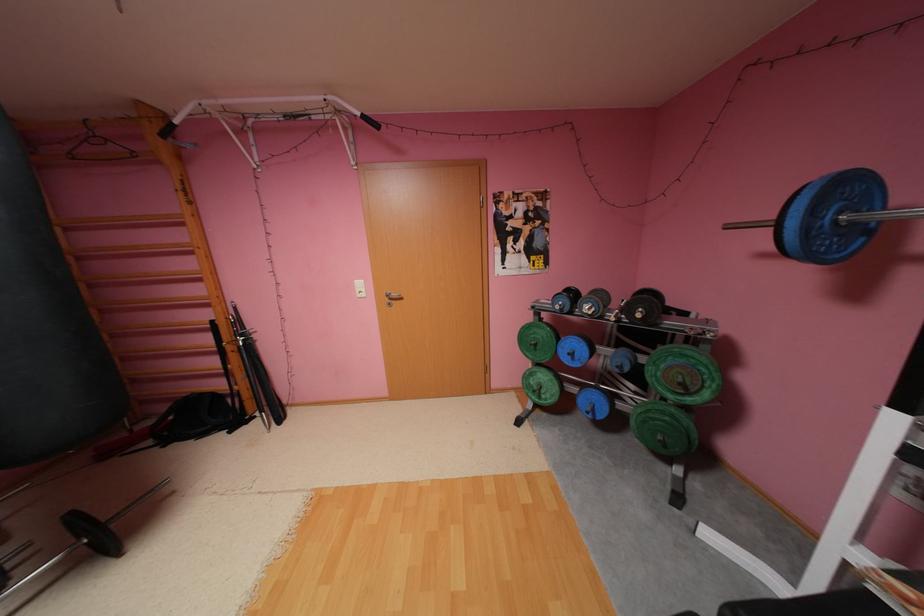
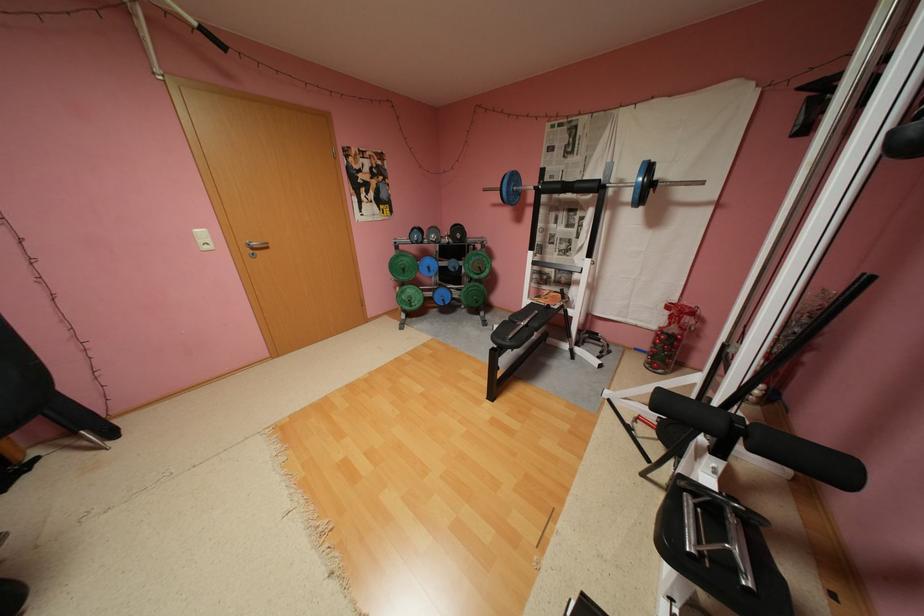
The point at (x=549, y=398) is marked in the first image. Where is the corresponding point in the second image?

(419, 306)